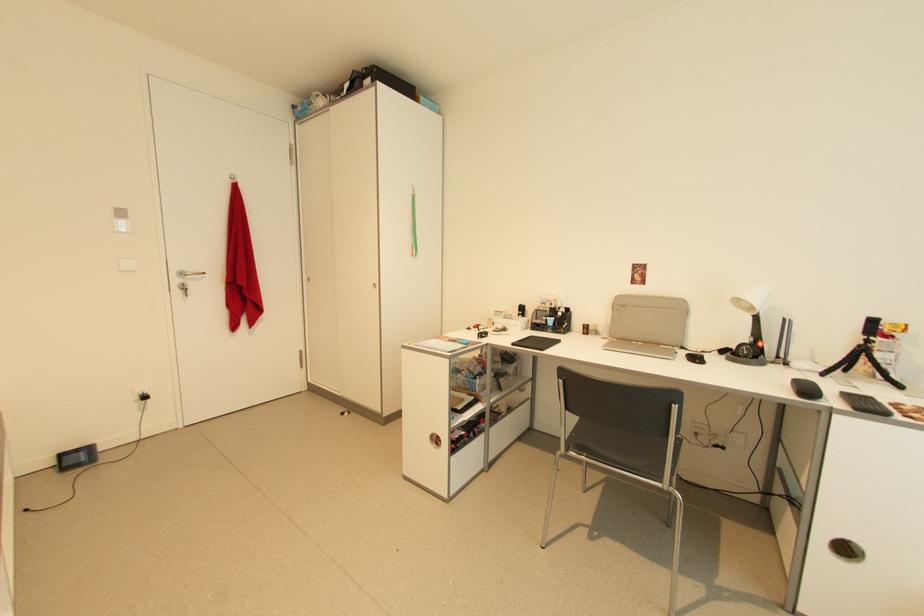
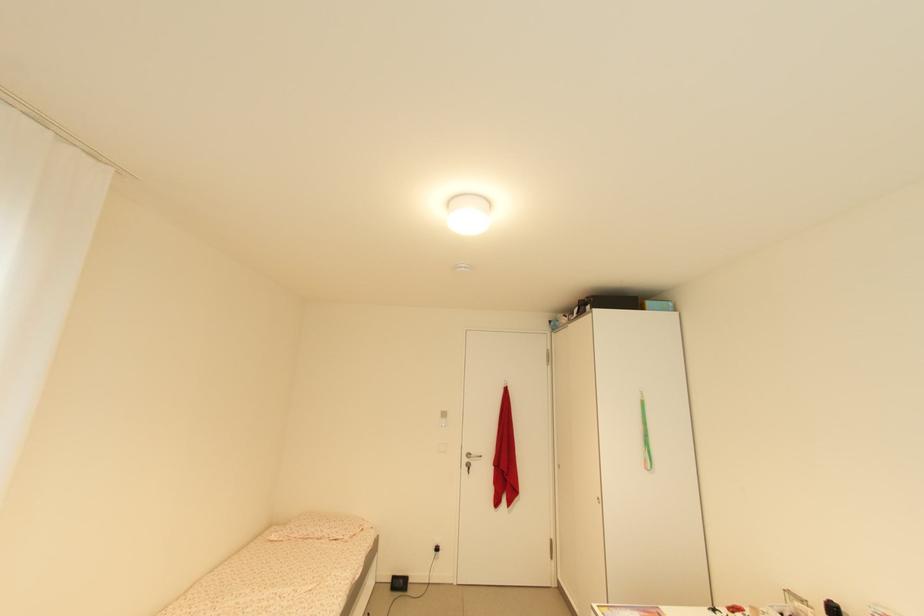
Where in the second image is the point corresponding to (x=187, y=276) from the first image?

(473, 456)